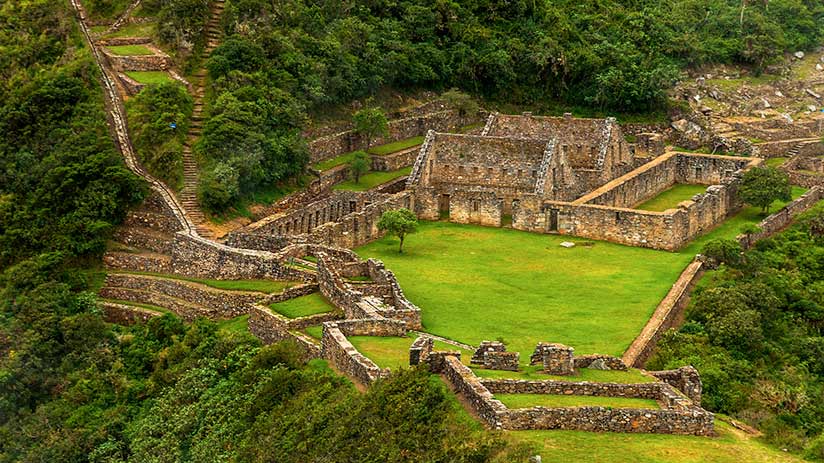
Locate an element on the screen. Image resolution: width=824 pixels, height=463 pixels. wall is located at coordinates (659, 224).